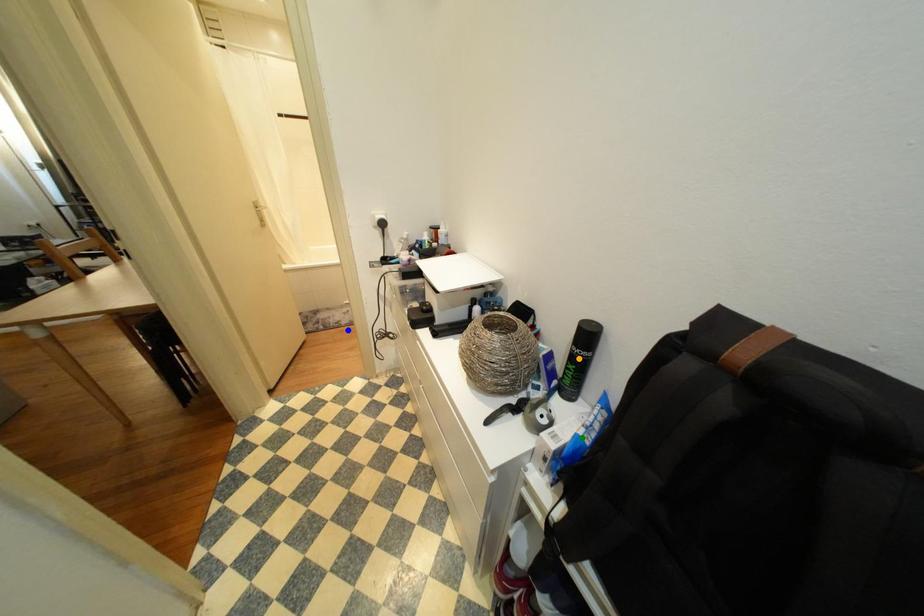
Order these from farthest to nearest:
1. orange point
2. green point
3. blue point

blue point, orange point, green point